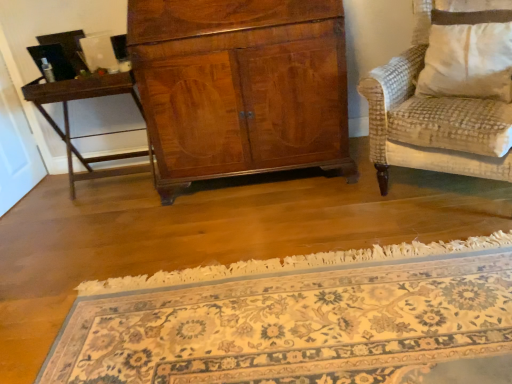
Question: Is dark brown wood table at left oriented away from floral carpet at center?

Choices:
 (A) yes
 (B) no

Answer: (B)

Question: Can floral carpet at center be found inside dark brown wood table at left?

Choices:
 (A) yes
 (B) no

Answer: (B)

Question: Considering the relative sizes of dark brown wood table at left and floral carpet at center in the image provided, is dark brown wood table at left thinner than floral carpet at center?

Choices:
 (A) yes
 (B) no

Answer: (A)

Question: Is dark brown wood table at left further to the viewer compared to floral carpet at center?

Choices:
 (A) yes
 (B) no

Answer: (A)

Question: Can you confirm if dark brown wood table at left is bigger than floral carpet at center?

Choices:
 (A) yes
 (B) no

Answer: (B)

Question: From the image's perspective, is dark brown wood table at left on floral carpet at center?

Choices:
 (A) yes
 (B) no

Answer: (A)

Question: Is dark brown wood table at left facing towards white textured pillow at right?

Choices:
 (A) yes
 (B) no

Answer: (B)

Question: Considering the relative positions of dark brown wood table at left and white textured pillow at right in the image provided, is dark brown wood table at left to the left of white textured pillow at right from the viewer's perspective?

Choices:
 (A) no
 (B) yes

Answer: (B)

Question: Considering the relative sizes of dark brown wood table at left and white textured pillow at right in the image provided, is dark brown wood table at left thinner than white textured pillow at right?

Choices:
 (A) yes
 (B) no

Answer: (B)

Question: From the image's perspective, is dark brown wood table at left located above white textured pillow at right?

Choices:
 (A) no
 (B) yes

Answer: (A)

Question: Is white textured pillow at right completely or partially inside dark brown wood table at left?

Choices:
 (A) yes
 (B) no

Answer: (B)

Question: Does dark brown wood table at left have a greater width compared to white textured pillow at right?

Choices:
 (A) no
 (B) yes

Answer: (B)

Question: Are floral carpet at center and dark brown wood table at left beside each other?

Choices:
 (A) no
 (B) yes

Answer: (A)